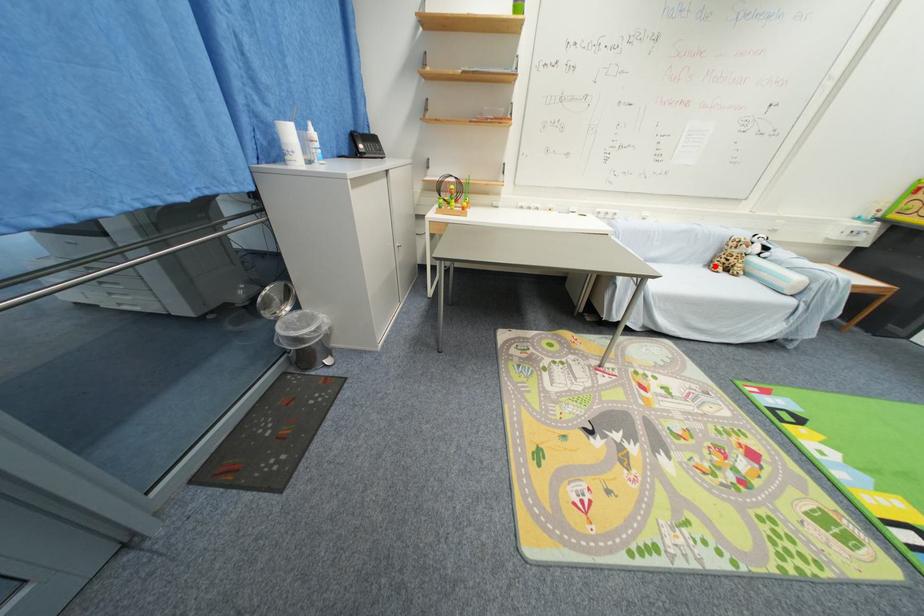
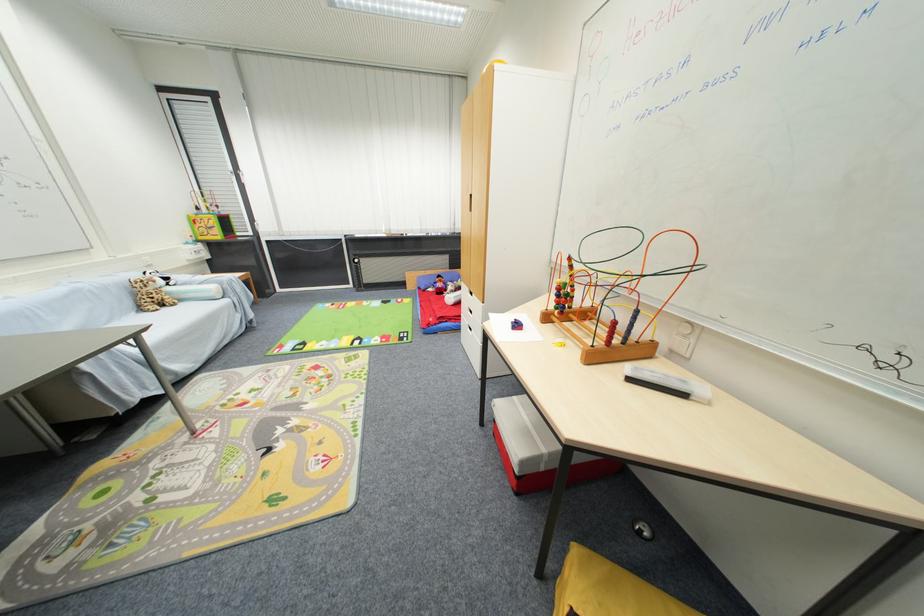
The point at the highlighted location is marked in the first image. Where is the corresponding point in the second image?

(146, 310)